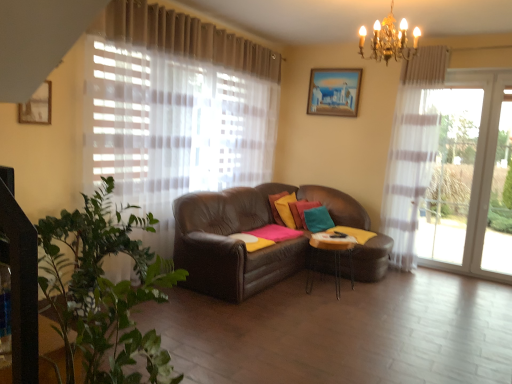
Question: Based on their sizes in the image, would you say wooden painted picture frame at upper center, the first picture frame viewed from the right, is bigger or smaller than gold metallic chandelier at upper center?

Choices:
 (A) small
 (B) big

Answer: (A)

Question: From the image's perspective, is wooden painted picture frame at upper center, marked as the 2th picture frame in a front-to-back arrangement, located above or below gold metallic chandelier at upper center?

Choices:
 (A) above
 (B) below

Answer: (A)

Question: Which object is the closest to the wooden painted picture frame at upper center, which is the 2th picture frame from bottom to top?

Choices:
 (A) gold metallic chandelier at upper center
 (B) metallic silver table at center
 (C) wooden picture frame at upper left, the 2th picture frame from the back
 (D) teal fabric pillow at center, arranged as the third pillow when viewed from the left
 (E) matte yellow pillow at center, acting as the 2th pillow starting from the right

Answer: (E)

Question: Based on their relative distances, which object is farther from the matte yellow pillow at center, acting as the 2th pillow starting from the right?

Choices:
 (A) wooden painted picture frame at upper center, which is the second picture frame in left-to-right order
 (B) metallic silver table at center
 (C) velvet yellow pillow at center, the third pillow positioned from the right
 (D) wooden picture frame at upper left, which is the second picture frame from right to left
 (E) gold metallic chandelier at upper center

Answer: (D)